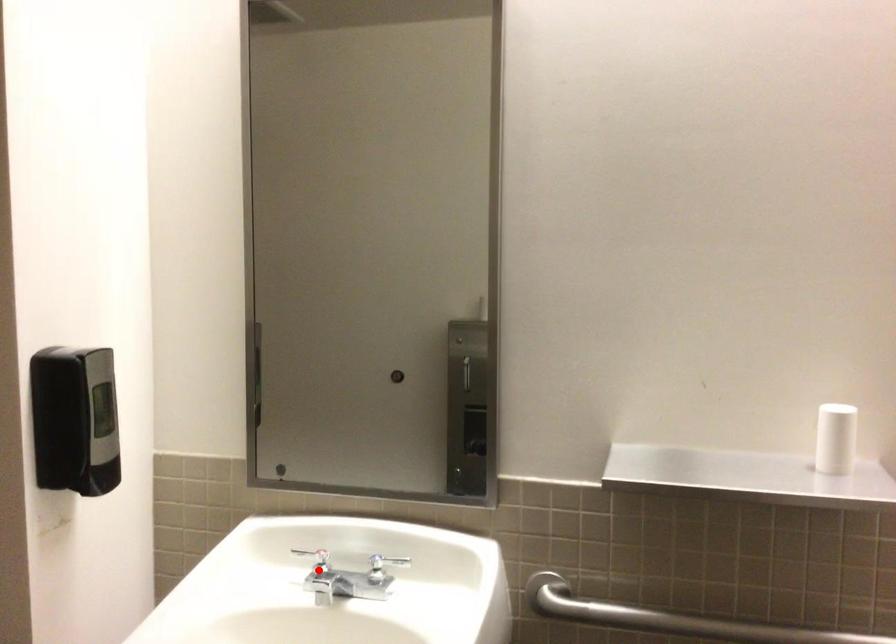
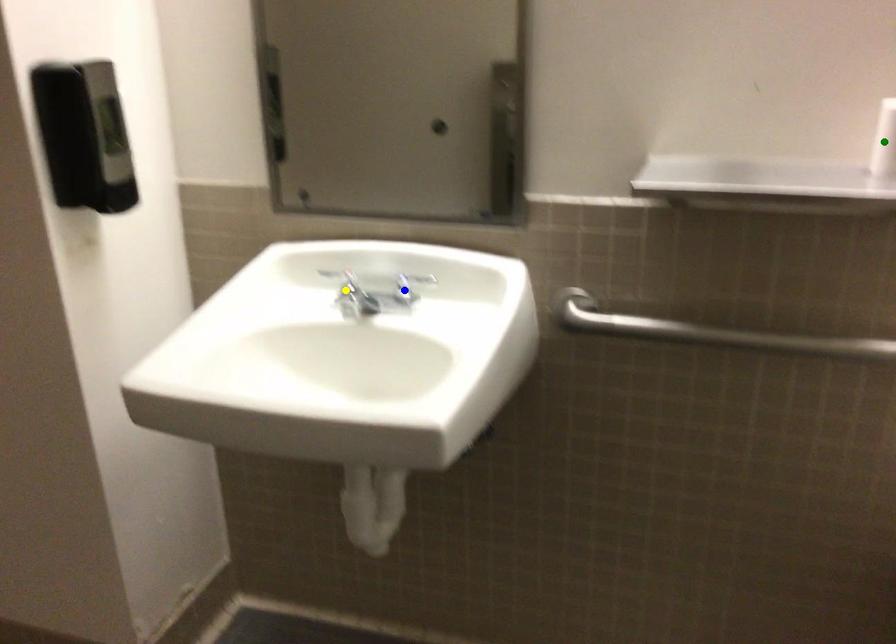
Question: I am providing you with two images of the same scene from different viewpoints. A red point is marked on the first image. You are given multiple points on the second image. Which mark in image 2 goes with the point in image 1?

Choices:
 (A) blue point
 (B) yellow point
 (C) green point

Answer: (B)